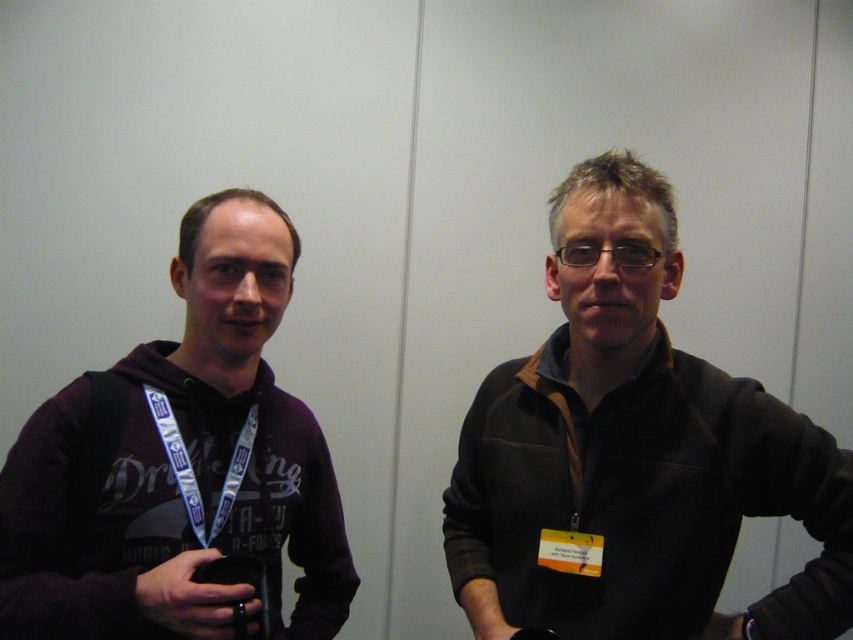
Question: Can you confirm if dark brown fleece at right is thinner than matte black hoodie at left?

Choices:
 (A) yes
 (B) no

Answer: (B)

Question: Is dark brown fleece at right further to the viewer compared to matte black hoodie at left?

Choices:
 (A) yes
 (B) no

Answer: (A)

Question: Among these points, which one is farthest from the camera?

Choices:
 (A) (344, 618)
 (B) (584, 484)

Answer: (A)

Question: Considering the relative positions of dark brown fleece at right and matte black hoodie at left in the image provided, where is dark brown fleece at right located with respect to matte black hoodie at left?

Choices:
 (A) above
 (B) below

Answer: (A)

Question: Which point appears farthest from the camera in this image?

Choices:
 (A) (664, 477)
 (B) (198, 506)

Answer: (B)